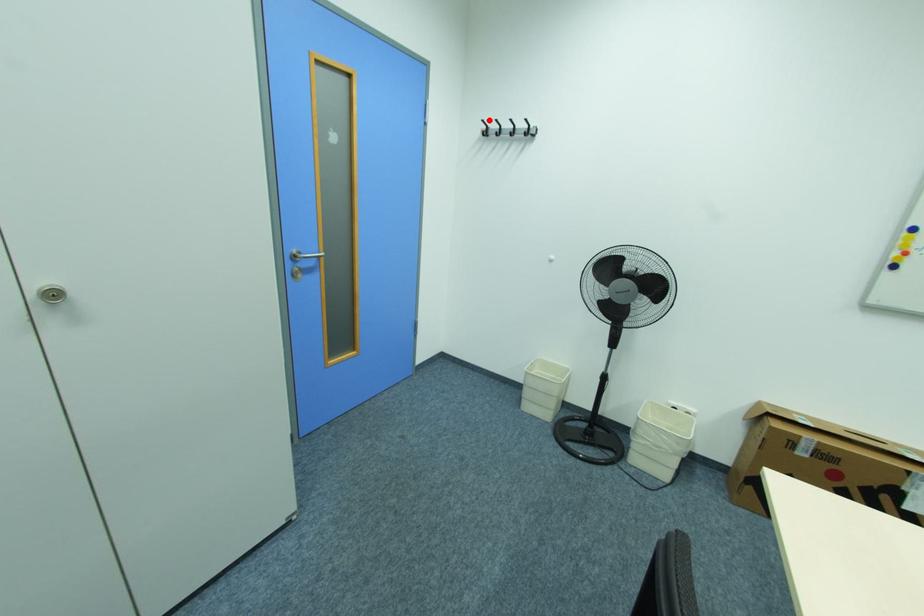
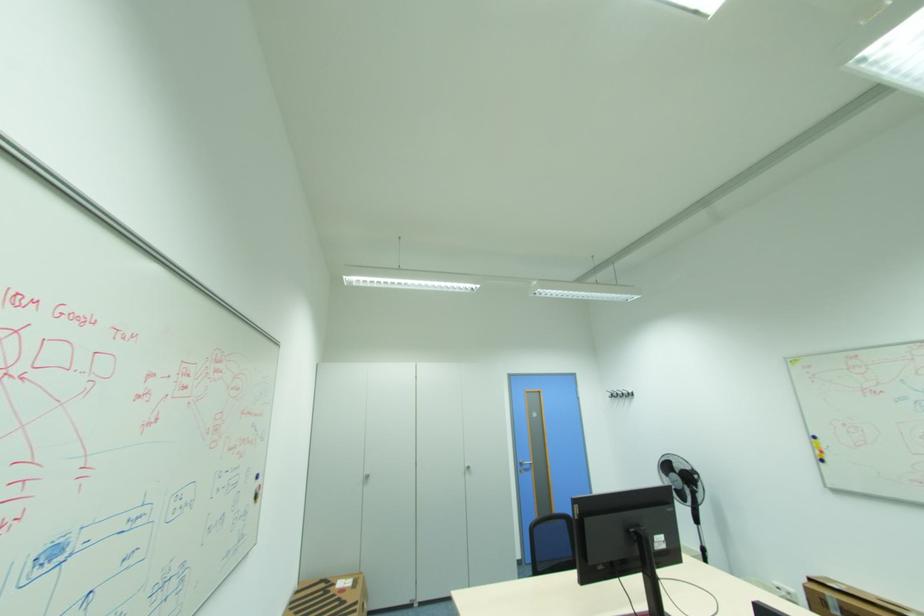
Question: I am providing you with two images of the same scene from different viewpoints. Given a red point in image1, look at the same physical point in image2. Is it:

Choices:
 (A) Closer to the viewpoint
 (B) Farther from the viewpoint

Answer: (B)